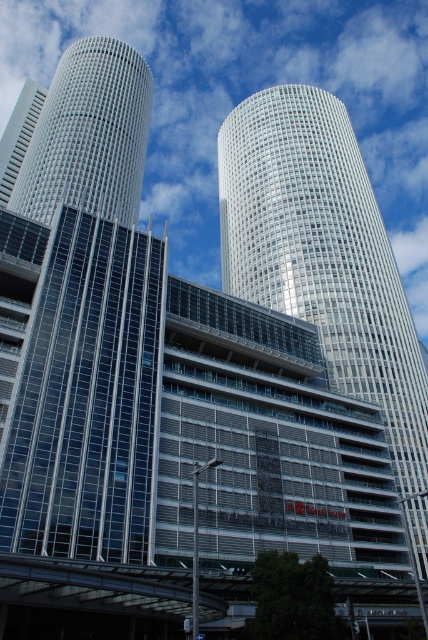
Who is more forward, (109, 168) or (38, 100)?

Point (109, 168) is more forward.

From the picture: Between matte glass skyscraper at center and matte glass skyscraper at upper left, which one appears on the left side from the viewer's perspective?

Positioned to the left is matte glass skyscraper at upper left.

Who is more forward, (127, 156) or (12, 145)?

Point (127, 156) is more forward.

Identify the location of matte glass skyscraper at center. Image resolution: width=428 pixels, height=640 pixels. (x=89, y=134).

Does silver glass tower at center have a greater height compared to matte glass skyscraper at upper left?

Yes.

Which is in front, point (253, 172) or point (17, 109)?

Positioned in front is point (253, 172).

Does point (421, 369) lie in front of point (9, 150)?

Yes.

The height and width of the screenshot is (640, 428). Find the location of `silver glass tower at center`. silver glass tower at center is located at coordinates (323, 253).

Which of these two, silver glass tower at center or matte glass skyscraper at center, stands taller?

Standing taller between the two is silver glass tower at center.

Does silver glass tower at center come in front of matte glass skyscraper at center?

Yes, silver glass tower at center is in front of matte glass skyscraper at center.

Between point (249, 259) and point (136, 76), which one is positioned in front?

Point (249, 259)

Where is `silver glass tower at center`? This screenshot has height=640, width=428. silver glass tower at center is located at coordinates point(323,253).